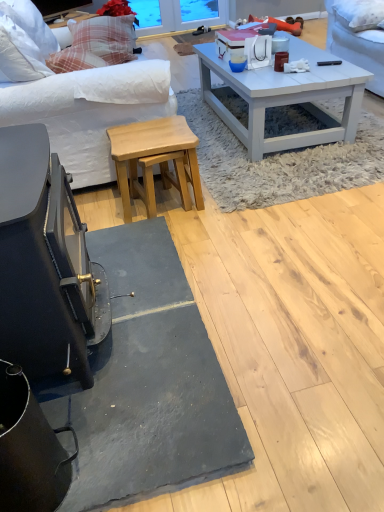
Question: Is white painted wood coffee table at center bigger than matte blue cup at center, positioned as the 1th coffee cup in left-to-right order?

Choices:
 (A) no
 (B) yes

Answer: (B)

Question: Does white painted wood coffee table at center have a lesser width compared to matte blue cup at center, positioned as the 1th coffee cup in left-to-right order?

Choices:
 (A) no
 (B) yes

Answer: (A)

Question: From a real-world perspective, is white painted wood coffee table at center on matte blue cup at center, positioned as the 2th coffee cup in right-to-left order?

Choices:
 (A) yes
 (B) no

Answer: (B)

Question: Would you say white painted wood coffee table at center is a long distance from matte blue cup at center, positioned as the 2th coffee cup in right-to-left order?

Choices:
 (A) yes
 (B) no

Answer: (B)

Question: Is white painted wood coffee table at center wider than matte blue cup at center, positioned as the 1th coffee cup in left-to-right order?

Choices:
 (A) no
 (B) yes

Answer: (B)

Question: Relative to gray felt mat at center, is plaid fabric pillow at upper left, the 2th pillow positioned from the bottom, in front or behind?

Choices:
 (A) behind
 (B) front

Answer: (A)

Question: From a real-world perspective, relative to gray felt mat at center, is plaid fabric pillow at upper left, the second pillow when ordered from front to back, vertically above or below?

Choices:
 (A) above
 (B) below

Answer: (A)

Question: Considering the positions of plaid fabric pillow at upper left, marked as the 1th pillow in a left-to-right arrangement, and gray felt mat at center in the image, is plaid fabric pillow at upper left, marked as the 1th pillow in a left-to-right arrangement, wider or thinner than gray felt mat at center?

Choices:
 (A) thin
 (B) wide

Answer: (A)

Question: Choose the correct answer: Is plaid fabric pillow at upper left, the second pillow when ordered from front to back, inside gray felt mat at center or outside it?

Choices:
 (A) outside
 (B) inside

Answer: (A)

Question: From the image's perspective, is matte brown coffee cup at center, positioned as the second coffee cup in left-to-right order, positioned above or below white painted wood coffee table at center?

Choices:
 (A) below
 (B) above

Answer: (A)

Question: Looking at their shapes, would you say matte brown coffee cup at center, the 1th coffee cup viewed from the right, is wider or thinner than white painted wood coffee table at center?

Choices:
 (A) thin
 (B) wide

Answer: (A)

Question: From a real-world perspective, is matte brown coffee cup at center, the 1th coffee cup viewed from the right, above or below white painted wood coffee table at center?

Choices:
 (A) below
 (B) above

Answer: (B)

Question: Would you say matte brown coffee cup at center, the 1th coffee cup viewed from the right, is inside or outside white painted wood coffee table at center?

Choices:
 (A) outside
 (B) inside

Answer: (A)

Question: In the image, is matte brown coffee cup at center, positioned as the second coffee cup in left-to-right order, positioned in front of or behind white soft pillow at upper right, the 2th pillow positioned from the left?

Choices:
 (A) front
 (B) behind

Answer: (A)

Question: In terms of height, does matte brown coffee cup at center, the 1th coffee cup viewed from the right, look taller or shorter compared to white soft pillow at upper right, placed as the 1th pillow when sorted from right to left?

Choices:
 (A) tall
 (B) short

Answer: (B)